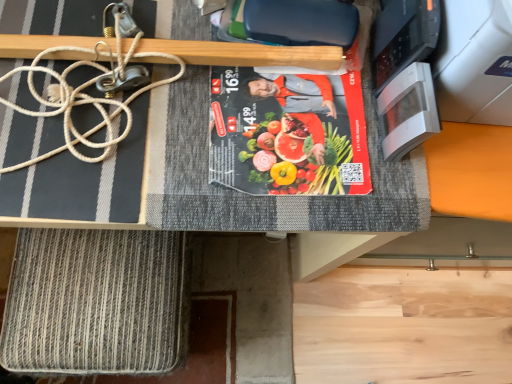
This screenshot has height=384, width=512. Describe the element at coordinates (95, 302) in the screenshot. I see `rope-like textured mat at lower left` at that location.

Where is `rope-like textured mat at lower left`? The height and width of the screenshot is (384, 512). rope-like textured mat at lower left is located at coordinates pyautogui.click(x=95, y=302).

Is wooden at upper center taller than rope-like textured mat at lower left?

In fact, wooden at upper center may be shorter than rope-like textured mat at lower left.

In the scene shown: From the image's perspective, is wooden at upper center on top of rope-like textured mat at lower left?

Yes, from the image's perspective, wooden at upper center is above rope-like textured mat at lower left.

Are wooden at upper center and rope-like textured mat at lower left making contact?

No, wooden at upper center is not in contact with rope-like textured mat at lower left.

Is wooden at upper center in front of or behind rope-like textured mat at lower left in the image?

wooden at upper center is positioned closer to the viewer than rope-like textured mat at lower left.

From a real-world perspective, between white rope at upper left and rope-like textured mat at lower left, who is vertically higher?

From a 3D spatial view, white rope at upper left is above.

Is white rope at upper left facing away from rope-like textured mat at lower left?

No.

Considering the sizes of objects white rope at upper left and rope-like textured mat at lower left in the image provided, who is taller, white rope at upper left or rope-like textured mat at lower left?

rope-like textured mat at lower left is taller.

Where is `string above the rope-like textured mat at lower left (from a real-world perspective)`? Image resolution: width=512 pixels, height=384 pixels. string above the rope-like textured mat at lower left (from a real-world perspective) is located at coordinates (86, 97).

Considering the sizes of objects white rope at upper left and matte black book at center in the image provided, who is smaller, white rope at upper left or matte black book at center?

With smaller size is matte black book at center.

From the image's perspective, is white rope at upper left positioned above or below matte black book at center?

Clearly, from the image's perspective, white rope at upper left is above matte black book at center.

Is matte black book at center at the back of white rope at upper left?

No, white rope at upper left's orientation is not away from matte black book at center.

Which object is more forward, white glossy microwave at upper right or matte black book at center?

Positioned in front is white glossy microwave at upper right.

From the image's perspective, is white glossy microwave at upper right above or below matte black book at center?

Clearly, from the image's perspective, white glossy microwave at upper right is below matte black book at center.

Which point is more forward, (397, 8) or (309, 183)?

Positioned in front is point (309, 183).

Looking at this image, is matte black book at center located within white glossy microwave at upper right?

No, white glossy microwave at upper right does not contain matte black book at center.

Where is `appliance in front of the matte black book at center`? This screenshot has height=384, width=512. appliance in front of the matte black book at center is located at coordinates (405, 74).

Is matte black book at center not close to white glossy microwave at upper right?

matte black book at center is actually quite close to white glossy microwave at upper right.

Is matte black book at center inside or outside of white glossy microwave at upper right?

matte black book at center is not inside white glossy microwave at upper right, it's outside.

Is white glossy microwave at upper right facing away from white rope at upper left?

No, white glossy microwave at upper right's orientation is not away from white rope at upper left.

From the image's perspective, is white glossy microwave at upper right under white rope at upper left?

Indeed, from the image's perspective, white glossy microwave at upper right is shown beneath white rope at upper left.

How many degrees apart are the facing directions of white glossy microwave at upper right and white rope at upper left?

white glossy microwave at upper right and white rope at upper left are facing 93.4 degrees away from each other.

How far apart are white glossy microwave at upper right and white rope at upper left?

13.10 inches.

Is matte black book at center bigger or smaller than wooden at upper center?

Clearly, matte black book at center is larger in size than wooden at upper center.

How different are the orientations of matte black book at center and wooden at upper center in degrees?

2.45 degrees.

Is matte black book at center taller or shorter than wooden at upper center?

Clearly, matte black book at center is shorter compared to wooden at upper center.

Which is less distant, (250, 171) or (74, 52)?

The point (250, 171) is more forward.

This screenshot has width=512, height=384. There is a rope-like textured mat at lower left. In order to click on wood above it (from a real-world perspective) in this screenshot , I will do 246,54.

You are a GUI agent. You are given a task and a screenshot of the screen. Output one action in this format:
    pyautogui.click(x=<x>, y=<y>)
    Task: Click on the string on the right of rope-like textured mat at lower left
    Image resolution: width=512 pixels, height=384 pixels.
    Given the screenshot: What is the action you would take?
    pyautogui.click(x=86, y=97)

Looking at the image, which one is located closer to white rope at upper left, wooden at upper center or white glossy microwave at upper right?

wooden at upper center is positioned closer to the anchor white rope at upper left.

Based on their spatial positions, is wooden at upper center or white rope at upper left closer to matte black book at center?

Based on the image, wooden at upper center appears to be nearer to matte black book at center.

Looking at the image, which one is located further to white rope at upper left, wooden at upper center or rope-like textured mat at lower left?

rope-like textured mat at lower left is further to white rope at upper left.

Which object lies nearer to the anchor point white glossy microwave at upper right, wooden at upper center or rope-like textured mat at lower left?

The object closer to white glossy microwave at upper right is wooden at upper center.

Which object lies further to the anchor point matte black book at center, white rope at upper left or wooden at upper center?

Based on the image, white rope at upper left appears to be further to matte black book at center.

Which object lies nearer to the anchor point wooden at upper center, matte black book at center or rope-like textured mat at lower left?

Among the two, matte black book at center is located nearer to wooden at upper center.

Considering their positions, is white rope at upper left positioned closer to rope-like textured mat at lower left than wooden at upper center?

white rope at upper left is closer to rope-like textured mat at lower left.

Looking at this image, when comparing their distances from matte black book at center, does rope-like textured mat at lower left or white rope at upper left seem closer?

white rope at upper left is positioned closer to the anchor matte black book at center.

Where is `wood located between white rope at upper left and matte black book at center in the left-right direction`? wood located between white rope at upper left and matte black book at center in the left-right direction is located at coordinates (246, 54).

Where is `string located between rope-like textured mat at lower left and white glossy microwave at upper right in the left-right direction`? This screenshot has width=512, height=384. string located between rope-like textured mat at lower left and white glossy microwave at upper right in the left-right direction is located at coordinates (86, 97).

Identify the location of wood between rope-like textured mat at lower left and white glossy microwave at upper right. coord(246,54).

Identify the location of paperback book between wooden at upper center and rope-like textured mat at lower left from top to bottom. (288, 133).